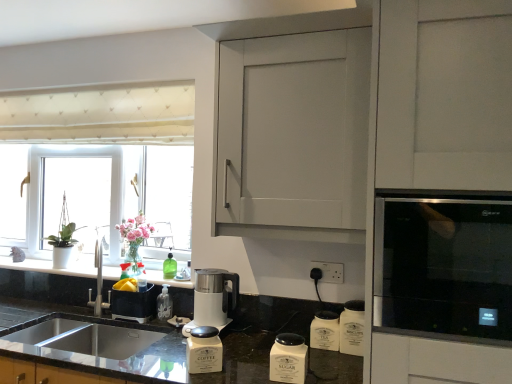
What do you see at coordinates (352, 328) in the screenshot?
I see `white matte biscuit jar at lower center, the 1th appliance from the right` at bounding box center [352, 328].

Identify the location of white matte sugar container at lower center, the fourth appliance viewed from the left. The height and width of the screenshot is (384, 512). coord(288,359).

The height and width of the screenshot is (384, 512). I want to click on black granite sink at lower left, the first countertop when ordered from top to bottom, so click(52, 266).

This screenshot has width=512, height=384. What are the coordinates of `matte white cabinet at upper center` in the screenshot? It's located at (294, 130).

You are a GUI agent. You are given a task and a screenshot of the screen. Output one action in this format:
    pyautogui.click(x=<x>, y=<y>)
    Task: Click on the white matte coffee container at lower center, the fourth appliance when ordered from right to left
    The height and width of the screenshot is (384, 512).
    Given the screenshot: What is the action you would take?
    pyautogui.click(x=204, y=350)

This screenshot has height=384, width=512. What do you see at coordinates (85, 337) in the screenshot?
I see `stainless steel sink at lower left` at bounding box center [85, 337].

The width and height of the screenshot is (512, 384). In order to click on white matte biscuit jar at lower center, which is counted as the 6th appliance, starting from the left in this screenshot , I will do `click(352, 328)`.

Does matte white cabinet at upper center turn towards matte black container at lower left, which is counted as the 6th appliance, starting from the right?

No, matte white cabinet at upper center is not oriented towards matte black container at lower left, which is counted as the 6th appliance, starting from the right.

What are the coordinates of `cabinetry located above the matte black container at lower left, which is counted as the 6th appliance, starting from the right (from the image's perspective)` in the screenshot? It's located at (294, 130).

From a real-world perspective, relative to matte black container at lower left, which is counted as the 6th appliance, starting from the right, is matte white cabinet at upper center vertically above or below?

matte white cabinet at upper center is situated higher than matte black container at lower left, which is counted as the 6th appliance, starting from the right, in the real world.

Does translucent plastic soap dispenser at lower center, which is the second appliance in left-to-right order, appear on the left side of matte black container at lower left, which is counted as the 6th appliance, starting from the right?

No, translucent plastic soap dispenser at lower center, which is the second appliance in left-to-right order, is not to the left of matte black container at lower left, which is counted as the 6th appliance, starting from the right.

Considering the positions of objects translucent plastic soap dispenser at lower center, which is the second appliance in left-to-right order, and matte black container at lower left, which is counted as the 6th appliance, starting from the right, in the image provided, who is behind, translucent plastic soap dispenser at lower center, which is the second appliance in left-to-right order, or matte black container at lower left, which is counted as the 6th appliance, starting from the right,?

translucent plastic soap dispenser at lower center, which is the second appliance in left-to-right order.

Is translucent plastic soap dispenser at lower center, which is the second appliance in left-to-right order, far from matte black container at lower left, which is counted as the 6th appliance, starting from the right?

Actually, translucent plastic soap dispenser at lower center, which is the second appliance in left-to-right order, and matte black container at lower left, which is counted as the 6th appliance, starting from the right, are a little close together.

Considering the positions of points (414, 237) and (359, 347), is point (414, 237) closer to camera compared to point (359, 347)?

Yes.

Is white matte biscuit jar at lower center, the 1th appliance from the right, a part of stainless steel microwave at right?

No, white matte biscuit jar at lower center, the 1th appliance from the right, is not inside stainless steel microwave at right.

From a real-world perspective, between stainless steel microwave at right and white matte biscuit jar at lower center, the 1th appliance from the right, who is vertically higher?

In real-world perspective, stainless steel microwave at right is above.

Between white plastic kettle at center and black granite countertop at lower center, which is counted as the first countertop, starting from the bottom, which one appears on the right side from the viewer's perspective?

white plastic kettle at center is more to the right.

Does white plastic kettle at center have a larger size compared to black granite countertop at lower center, which is counted as the first countertop, starting from the bottom?

Incorrect, white plastic kettle at center is not larger than black granite countertop at lower center, which is counted as the first countertop, starting from the bottom.

The image size is (512, 384). In order to click on kitchen appliance on the right of black granite countertop at lower center, which is counted as the first countertop, starting from the bottom in this screenshot , I will do `click(212, 299)`.

Is white matte biscuit jar at lower center, the 1th appliance from the right, oriented away from black granite countertop at lower center, the second countertop when ordered from top to bottom?

Yes, white matte biscuit jar at lower center, the 1th appliance from the right, is facing away from black granite countertop at lower center, the second countertop when ordered from top to bottom.

From the image's perspective, is white matte biscuit jar at lower center, the 1th appliance from the right, located above or below black granite countertop at lower center, the second countertop when ordered from top to bottom?

white matte biscuit jar at lower center, the 1th appliance from the right, is situated higher than black granite countertop at lower center, the second countertop when ordered from top to bottom, in the image.

Does white matte biscuit jar at lower center, which is counted as the 6th appliance, starting from the left, have a lesser height compared to black granite countertop at lower center, the second countertop when ordered from top to bottom?

Indeed, white matte biscuit jar at lower center, which is counted as the 6th appliance, starting from the left, has a lesser height compared to black granite countertop at lower center, the second countertop when ordered from top to bottom.

How distant is stainless steel microwave at right from stainless steel sink at lower left?

They are 1.38 meters apart.

Is point (472, 251) more distant than point (39, 322)?

That is False.

Is stainless steel microwave at right looking in the opposite direction of stainless steel sink at lower left?

No, stainless steel microwave at right is not facing the opposite direction of stainless steel sink at lower left.

Is stainless steel microwave at right beside stainless steel sink at lower left?

No, stainless steel microwave at right is not touching stainless steel sink at lower left.

Is stainless steel sink at lower left behind white matte sugar container at lower center, marked as the 3th appliance in a right-to-left arrangement?

Yes, the depth of stainless steel sink at lower left is greater than that of white matte sugar container at lower center, marked as the 3th appliance in a right-to-left arrangement.

You are a GUI agent. You are given a task and a screenshot of the screen. Output one action in this format:
    pyautogui.click(x=<x>, y=<y>)
    Task: Click on the sink below the white matte sugar container at lower center, the fourth appliance viewed from the left (from the image's perspective)
    The height and width of the screenshot is (384, 512).
    Given the screenshot: What is the action you would take?
    pyautogui.click(x=85, y=337)

Is stainless steel sink at lower left far from white matte sugar container at lower center, marked as the 3th appliance in a right-to-left arrangement?

Yes, stainless steel sink at lower left and white matte sugar container at lower center, marked as the 3th appliance in a right-to-left arrangement, are quite far apart.

Considering the sizes of stainless steel sink at lower left and white matte sugar container at lower center, marked as the 3th appliance in a right-to-left arrangement, in the image, is stainless steel sink at lower left wider or thinner than white matte sugar container at lower center, marked as the 3th appliance in a right-to-left arrangement,?

Clearly, stainless steel sink at lower left has more width compared to white matte sugar container at lower center, marked as the 3th appliance in a right-to-left arrangement.

This screenshot has width=512, height=384. I want to click on appliance that is the 4th one when counting backward from the matte white cabinet at upper center, so click(134, 304).

Locate an element on the screen. appliance located on the left of translucent plastic soap dispenser at lower center, acting as the 5th appliance starting from the right is located at coordinates (134, 304).

From the image, which object appears to be nearer to matte black container at lower left, which is counted as the 6th appliance, starting from the right, stainless steel sink at lower left or white matte biscuit jar at lower center, which is counted as the 6th appliance, starting from the left?

Based on the image, stainless steel sink at lower left appears to be nearer to matte black container at lower left, which is counted as the 6th appliance, starting from the right.

Looking at the image, which one is located closer to matte white cabinet at upper center, translucent plastic soap dispenser at lower center, which is the second appliance in left-to-right order, or white plastic window at left?

Among the two, white plastic window at left is located nearer to matte white cabinet at upper center.

When comparing their distances from matte white cabinet at upper center, does translucent plastic soap dispenser at lower center, which is the second appliance in left-to-right order, or white ceramic canisters at lower center, which is the fifth appliance from left to right, seem closer?

Based on the image, white ceramic canisters at lower center, which is the fifth appliance from left to right, appears to be nearer to matte white cabinet at upper center.

Looking at the image, which one is located further to matte black container at lower left, the first appliance when ordered from left to right, white ceramic canisters at lower center, which is the 2th appliance from right to left, or matte white cabinet at upper center?

Based on the image, matte white cabinet at upper center appears to be further to matte black container at lower left, the first appliance when ordered from left to right.

Estimate the real-world distances between objects in this image. Which object is closer to stainless steel sink at lower left, white ceramic canisters at lower center, which is the 2th appliance from right to left, or matte white cabinet at upper center?

→ white ceramic canisters at lower center, which is the 2th appliance from right to left, lies closer to stainless steel sink at lower left than the other object.

Based on their spatial positions, is white plastic kettle at center or black granite sink at lower left, which appears as the 2th countertop when ordered from the bottom, closer to white matte biscuit jar at lower center, the 1th appliance from the right?

white plastic kettle at center is closer to white matte biscuit jar at lower center, the 1th appliance from the right.

Considering their positions, is stainless steel microwave at right positioned closer to black granite sink at lower left, the first countertop when ordered from top to bottom, than white ceramic canisters at lower center, which is the fifth appliance from left to right?

white ceramic canisters at lower center, which is the fifth appliance from left to right, is positioned closer to the anchor black granite sink at lower left, the first countertop when ordered from top to bottom.

When comparing their distances from white plastic window at left, does black granite countertop at lower center, which is counted as the first countertop, starting from the bottom, or white matte biscuit jar at lower center, the 1th appliance from the right, seem closer?

black granite countertop at lower center, which is counted as the first countertop, starting from the bottom.

This screenshot has height=384, width=512. I want to click on cabinetry located between black granite countertop at lower center, the second countertop when ordered from top to bottom, and stainless steel microwave at right in the left-right direction, so click(x=294, y=130).

Identify the location of kitchen appliance between white plastic window at left and white matte sugar container at lower center, marked as the 3th appliance in a right-to-left arrangement. (212, 299).

I want to click on countertop between stainless steel sink at lower left and white matte sugar container at lower center, marked as the 3th appliance in a right-to-left arrangement, from left to right, so click(x=258, y=336).

You are a GUI agent. You are given a task and a screenshot of the screen. Output one action in this format:
    pyautogui.click(x=<x>, y=<y>)
    Task: Click on the kitchen appliance located between black granite sink at lower left, the first countertop when ordered from top to bottom, and white ceramic canisters at lower center, which is the fifth appliance from left to right, in the left-right direction
    
    Given the screenshot: What is the action you would take?
    pyautogui.click(x=212, y=299)